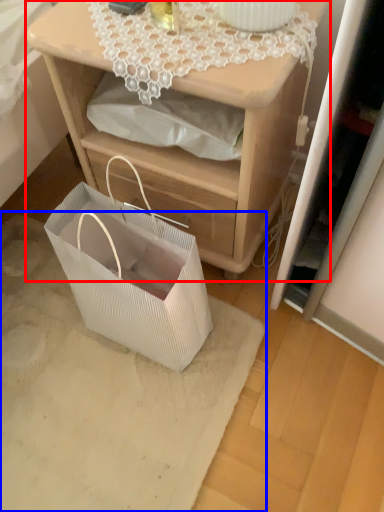
Question: Which point is further to the camera, nightstand (highlighted by a red box) or mat (highlighted by a blue box)?

Choices:
 (A) nightstand
 (B) mat

Answer: (B)